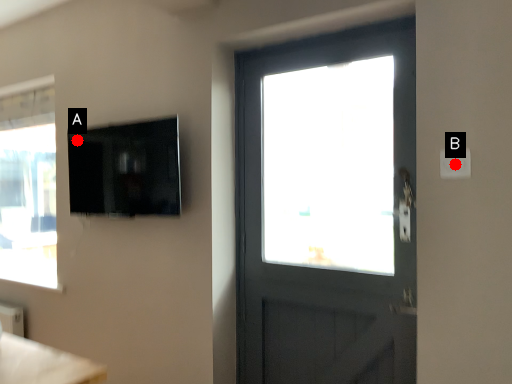
Question: Two points are circled on the image, labeled by A and B beside each circle. Which point is closer to the camera?

Choices:
 (A) A is closer
 (B) B is closer

Answer: (B)